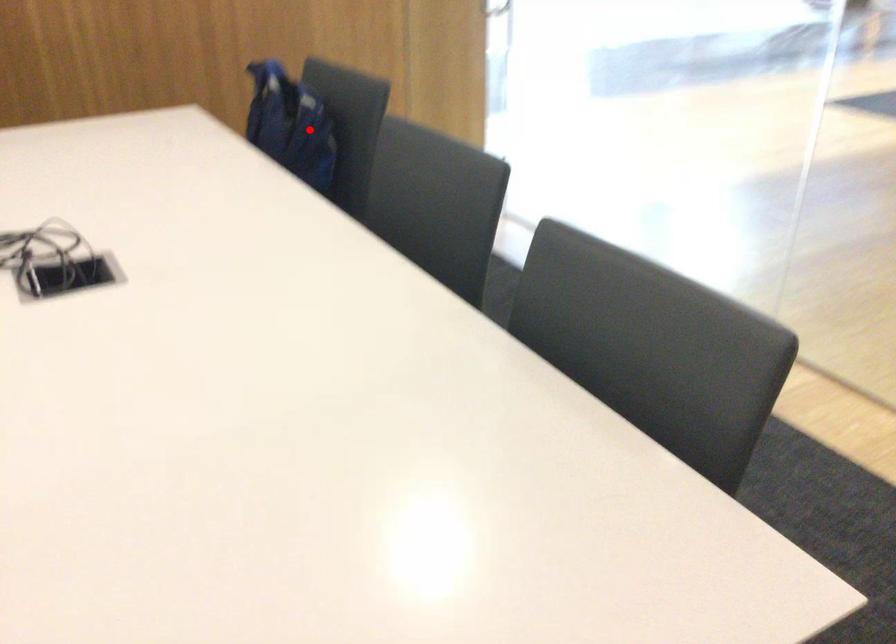
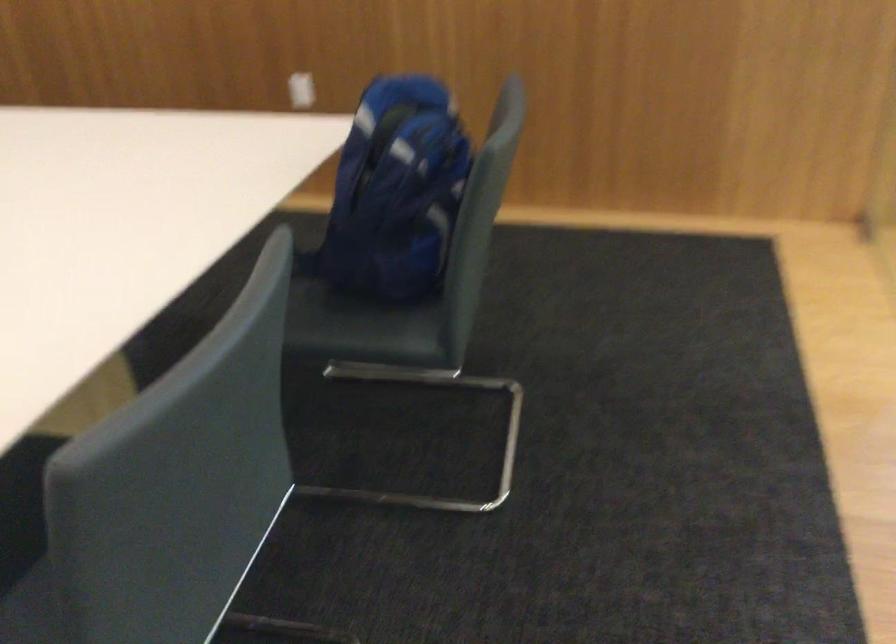
Question: I am providing you with two images of the same scene from different viewpoints. Given a red point in image1, look at the same physical point in image2. Is it:

Choices:
 (A) Closer to the viewpoint
 (B) Farther from the viewpoint

Answer: (A)